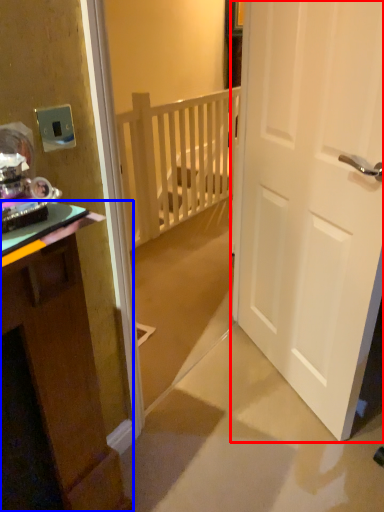
Question: Which point is further to the camera, door (highlighted by a red box) or cabinetry (highlighted by a blue box)?

Choices:
 (A) door
 (B) cabinetry

Answer: (A)